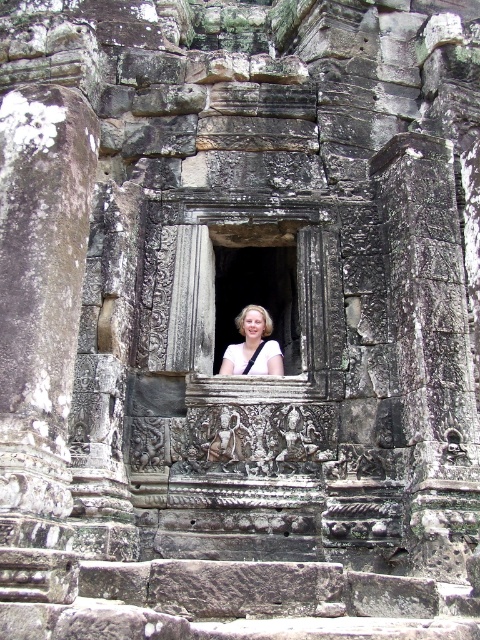
Consider the image. You are an archaeologist examining the ancient stone structure. You notice a transparent glass window at center and a blonde hair at center. Which object is positioned more to the left?

The transparent glass window at center is to the left of blonde hair at center.

You are standing in front of the ancient stone structure and see two points marked on the image. Which point is closer to you, point (228, 296) or point (264, 336)?

Point (264, 336) is closer to you than point (228, 296) because the description states that point (228, 296) is further to the camera than point (264, 336).